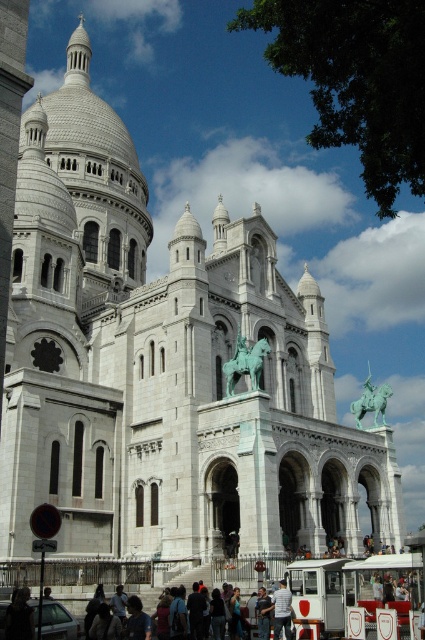
Question: Does dark brown leather jacket at lower left appear under green patinated metal horseman at center?

Choices:
 (A) no
 (B) yes

Answer: (B)

Question: Which object is closer to the camera taking this photo?

Choices:
 (A) dark brown leather jacket at lower left
 (B) white cotton shirt at center
 (C) green patinated metal horseman at center
 (D) dark blue shirt at lower center

Answer: (A)

Question: Is dark blue jeans at lower center below dark blue shirt at lower center?

Choices:
 (A) yes
 (B) no

Answer: (A)

Question: Which point appears closest to the camera in this image?

Choices:
 (A) (16, 620)
 (B) (130, 596)

Answer: (A)

Question: Is dark brown leather jacket at lower left bigger than white cotton shirt at center?

Choices:
 (A) no
 (B) yes

Answer: (B)

Question: Which point is farther from the camera taking this photo?

Choices:
 (A) (283, 602)
 (B) (235, 342)

Answer: (B)